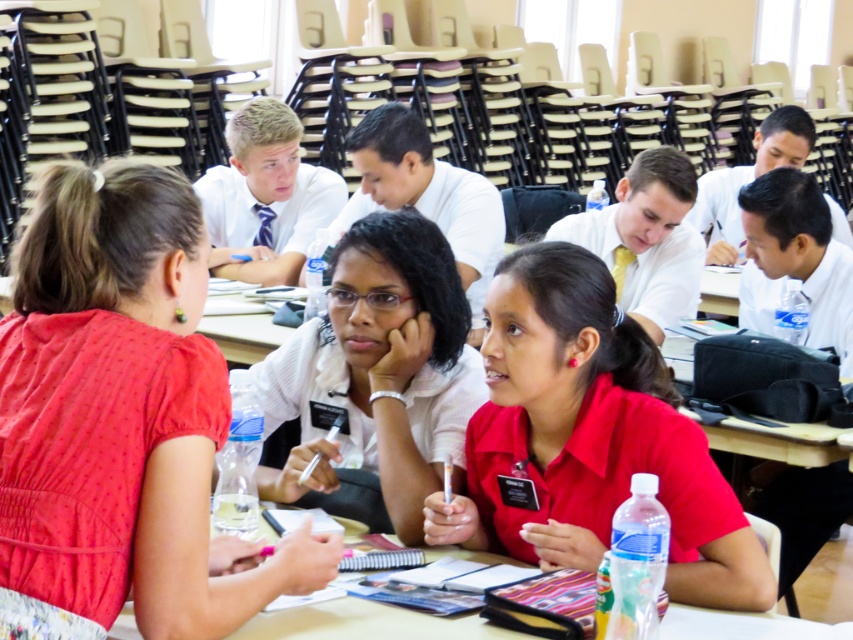
You are organizing a photo shoot and need to arrange two models wearing the red matte shirt at center and the matte white shirt at center. Based on the scene description, which model should stand on the left to ensure they have enough space between them?

The red matte shirt at center might be wider than the matte white shirt at center, so placing the model in the red matte shirt at center on the left would provide more space between them.

You are standing in the classroom and need to locate the red matte shirt at center. According to the coordinates provided, where exactly is it positioned in the image?

The red matte shirt at center is located at point 0.686 on the x axis and 0.691 on the y axis.